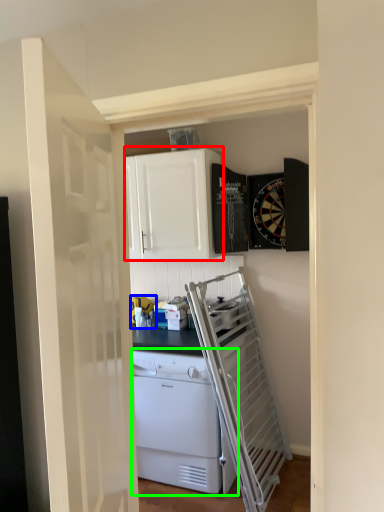
Question: Estimate the real-world distances between objects in this image. Which object is farther from cabinetry (highlighted by a red box), appliance (highlighted by a blue box) or home appliance (highlighted by a green box)?

Choices:
 (A) appliance
 (B) home appliance

Answer: (B)